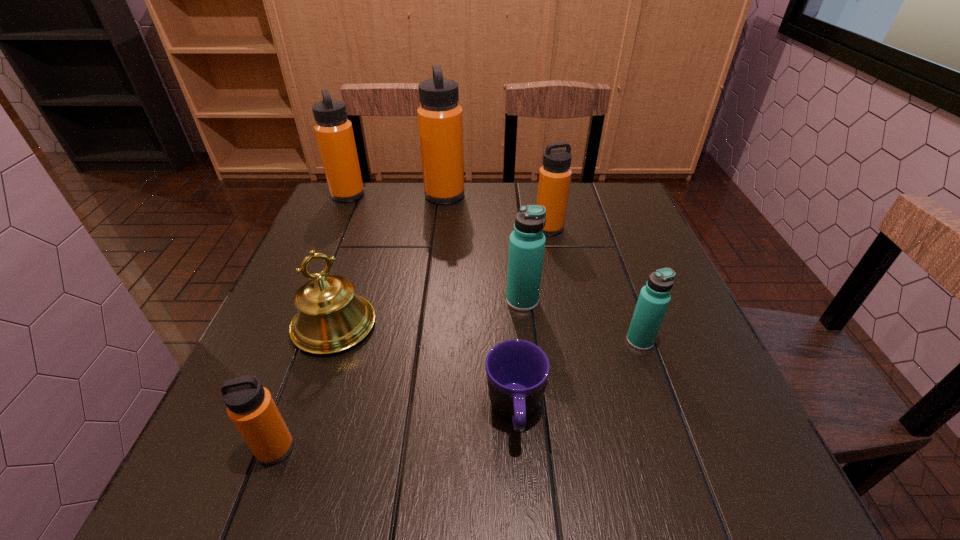
You are a GUI agent. You are given a task and a screenshot of the screen. Output one action in this format:
    pyautogui.click(x=<x>, y=<y>)
    Task: Click on the tallest object
    This screenshot has height=540, width=960.
    Given the screenshot: What is the action you would take?
    pyautogui.click(x=440, y=122)

Locate an element on the screen. The image size is (960, 540). the fourth object from left to right is located at coordinates (440, 122).

You are a GUI agent. You are given a task and a screenshot of the screen. Output one action in this format:
    pyautogui.click(x=<x>, y=<y>)
    Task: Click on the second tallest thermos bottle
    The height and width of the screenshot is (540, 960).
    Given the screenshot: What is the action you would take?
    pyautogui.click(x=334, y=133)

The width and height of the screenshot is (960, 540). I want to click on the second tallest object, so click(334, 133).

The height and width of the screenshot is (540, 960). Identify the location of the second thermos bottle from right to left. (555, 174).

Where is `the rightmost orange thermos bottle`? Image resolution: width=960 pixels, height=540 pixels. the rightmost orange thermos bottle is located at coordinates (555, 174).

Identify the location of the left aqua thermos bottle. The width and height of the screenshot is (960, 540). (527, 242).

Identify the location of the third nearest thermos bottle. Image resolution: width=960 pixels, height=540 pixels. (527, 242).

Identify the location of gold bell. The height and width of the screenshot is (540, 960). (331, 318).

This screenshot has width=960, height=540. Identify the location of the rightmost thermos bottle. (654, 298).